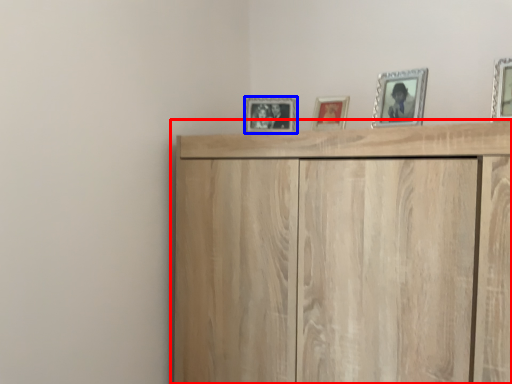
Question: Which object appears farthest to the camera in this image, cupboard (highlighted by a red box) or picture frame (highlighted by a blue box)?

Choices:
 (A) cupboard
 (B) picture frame

Answer: (B)